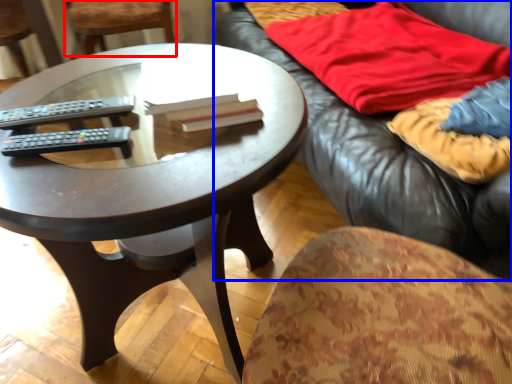
Question: Which object appears closest to the camera in this image, chair (highlighted by a red box) or studio couch (highlighted by a blue box)?

Choices:
 (A) chair
 (B) studio couch

Answer: (B)